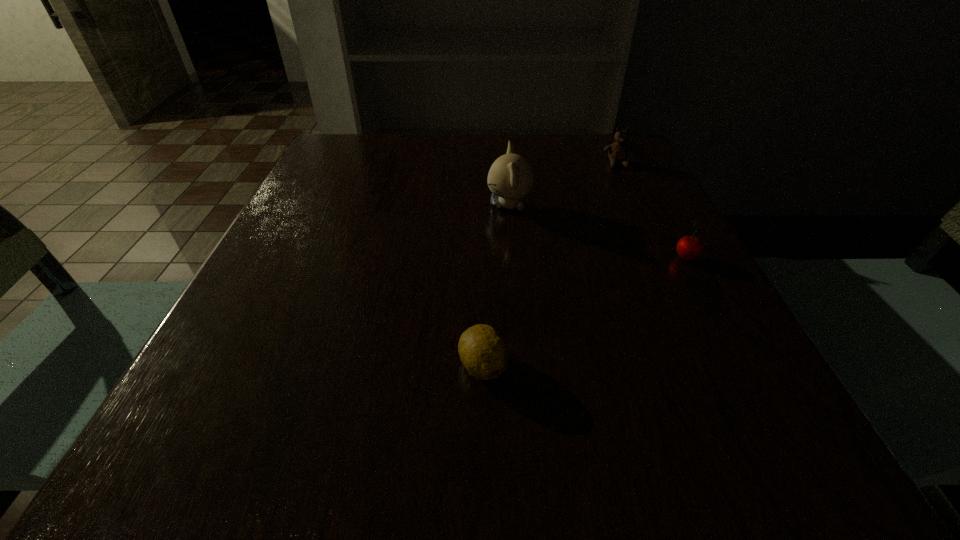
Find the location of a particular element. vacant region that satisfies the following two spatial constraints: 1. on the front-facing side of the third farthest object; 2. on the left side of the farthest object is located at coordinates pyautogui.click(x=663, y=259).

The image size is (960, 540). In order to click on free space that satisfies the following two spatial constraints: 1. on the face of the third farthest object; 2. on the right side of the tallest object in this screenshot , I will do `click(514, 259)`.

At what (x,y) coordinates should I click in order to perform the action: click on vacant space that satisfies the following two spatial constraints: 1. on the face of the kitten; 2. at the stem end of the nearest object. Please return your answer as a coordinate pair (x, y). Looking at the image, I should click on (523, 365).

I want to click on vacant region that satisfies the following two spatial constraints: 1. on the front-facing side of the third farthest object; 2. on the left side of the teddy bear, so click(663, 259).

This screenshot has height=540, width=960. What are the coordinates of `free space that satisfies the following two spatial constraints: 1. on the front-facing side of the third farthest object; 2. on the left side of the farthest object` in the screenshot? It's located at [x=663, y=259].